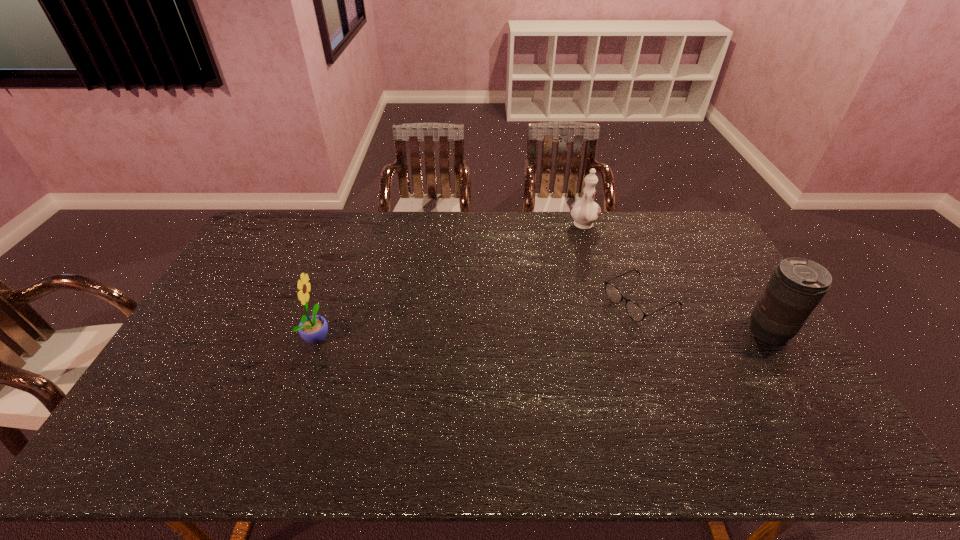
Find the location of `sunflower`. sunflower is located at coordinates (313, 329).

The image size is (960, 540). I want to click on telephoto lens, so click(x=797, y=285).

Locate an element on the screen. The image size is (960, 540). spectacles is located at coordinates (613, 293).

Where is `the farthest object`? This screenshot has width=960, height=540. the farthest object is located at coordinates (585, 212).

I want to click on free space located on the front-facing side of the leftmost object, so click(x=359, y=336).

I want to click on vacant space located on the side of the rightmost object where the control switches are located, so click(679, 332).

Identify the location of free location located on the side of the rightmost object where the control switches are located. (632, 332).

The width and height of the screenshot is (960, 540). I want to click on free location located on the side of the rightmost object where the control switches are located, so click(685, 332).

Identify the location of free space located 0.300m on the front-facing side of the shortest object. (535, 355).

What are the coordinates of `free point located 0.230m on the front-facing side of the shortest object` in the screenshot? It's located at (555, 345).